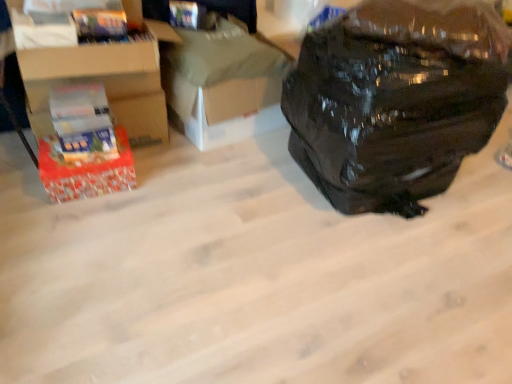
In order to click on free space in front of white cardboard box at center, marked as the second cardboard box in a left-to-right arrangement in this screenshot , I will do `click(220, 183)`.